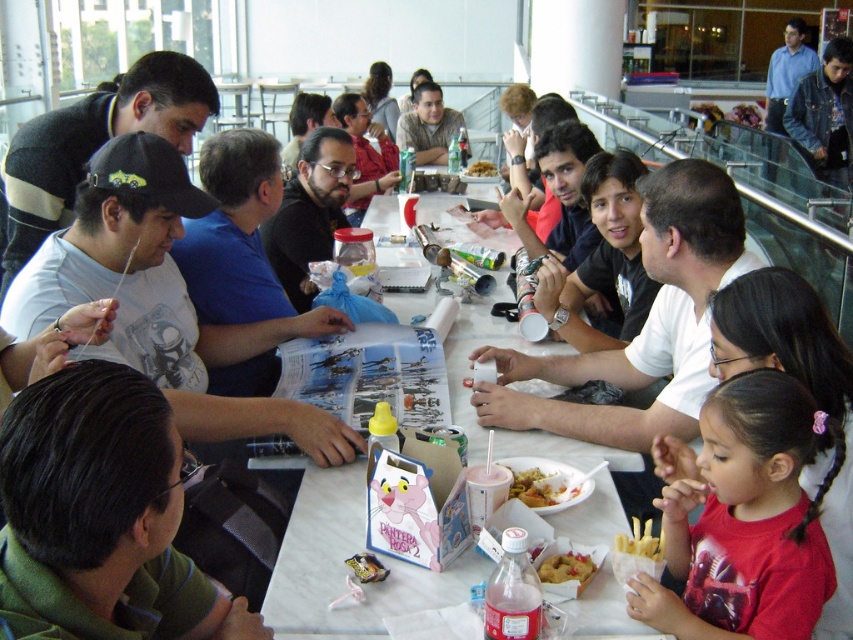
The image size is (853, 640). What do you see at coordinates (537, 486) in the screenshot?
I see `shiny plastic cup at center` at bounding box center [537, 486].

Can you confirm if shiny plastic cup at center is bigger than golden crispy french fries at lower center?

Yes.

Who is more forward, (x=532, y=499) or (x=572, y=560)?

Point (x=572, y=560)

Identify the location of shiny plastic cup at center. This screenshot has width=853, height=640. (537, 486).

Does white marble table at center have a greater height compared to shiny plastic cup at center?

Indeed, white marble table at center has a greater height compared to shiny plastic cup at center.

Is point (602, 627) positioned before point (552, 499)?

Yes, it is.

At what (x,y) coordinates should I click in order to perform the action: click on white marble table at center. Please return your answer as a coordinate pair (x, y). This screenshot has width=853, height=640. Looking at the image, I should click on (346, 566).

Find the location of `green fabric shirt at lower left`. green fabric shirt at lower left is located at coordinates (100, 516).

In the scene shown: Who is more forward, (x=209, y=621) or (x=439, y=593)?

Point (x=209, y=621)

Locate an element on the screen. The image size is (853, 640). green fabric shirt at lower left is located at coordinates (100, 516).